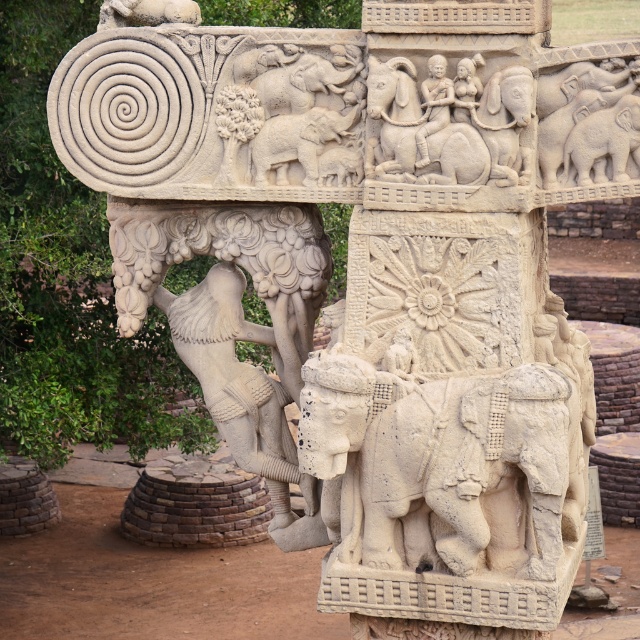
You are an archaeologist examining the ancient stone sculpture. You notice the white stone elephant at center and the smooth stone figure at center. Based on their positions, which one is located to the east side of the sculpture?

The white stone elephant at center is to the right of the smooth stone figure at center. Since the sculpture is viewed from the front, the right side corresponds to the east direction, so the white stone elephant at center is located to the east side of the sculpture.